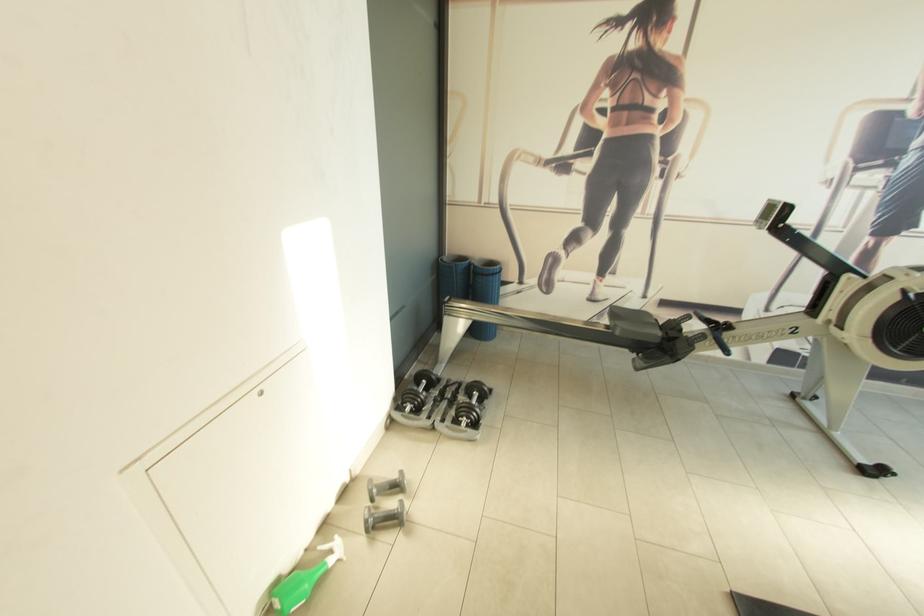
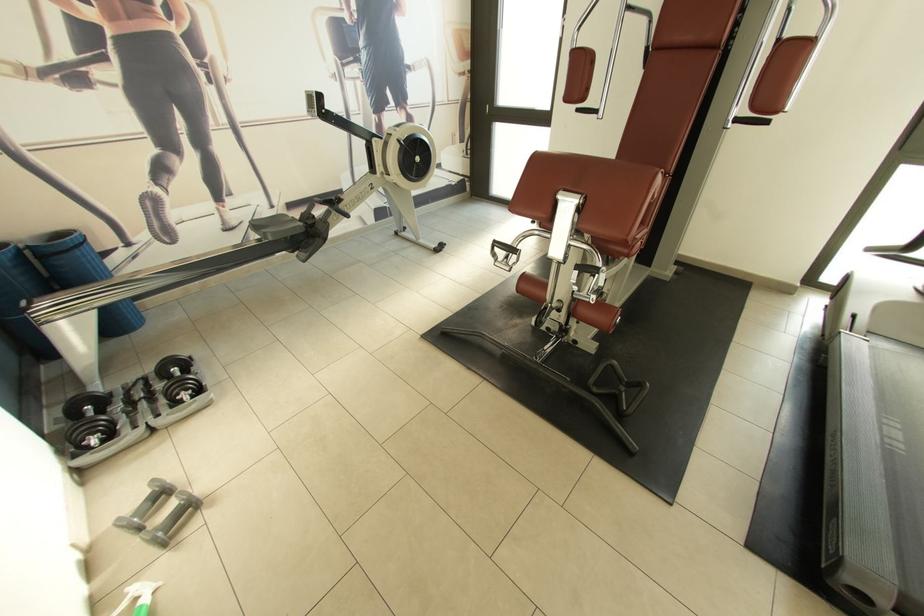
The point at (480, 426) is marked in the first image. Where is the corresponding point in the second image?

(204, 392)